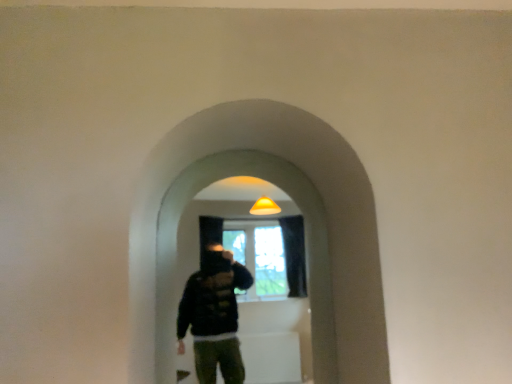
The image size is (512, 384). What do you see at coordinates (306, 245) in the screenshot?
I see `white matte arch at center` at bounding box center [306, 245].

Locate an element on the screen. This screenshot has width=512, height=384. white matte arch at center is located at coordinates (306, 245).

Locate an element on the screen. The image size is (512, 384). white matte arch at center is located at coordinates (306, 245).